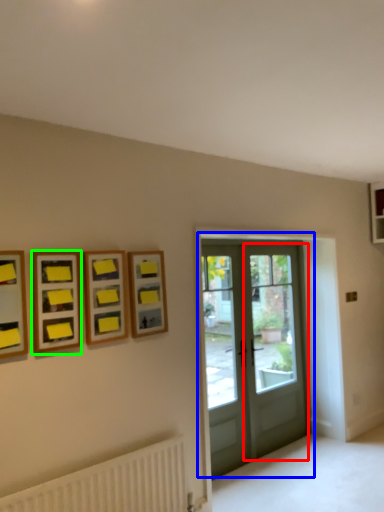
Question: Estimate the real-world distances between objects in this image. Which object is farther from screen door (highlighted by a red box), door (highlighted by a blue box) or picture frame (highlighted by a green box)?

Choices:
 (A) door
 (B) picture frame

Answer: (B)